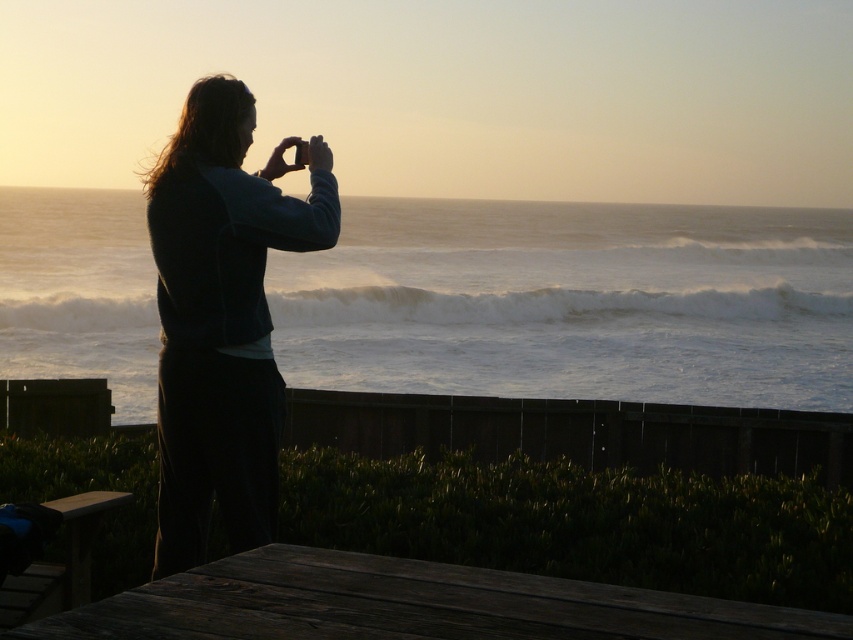
The height and width of the screenshot is (640, 853). Find the location of `silhouette fabric jacket at left`. silhouette fabric jacket at left is located at coordinates (222, 317).

Is silhouette fabric jacket at left thinner than dark brown wooden picnic table at lower center?

Indeed, silhouette fabric jacket at left has a lesser width compared to dark brown wooden picnic table at lower center.

Is point (258, 269) positioned after point (167, 632)?

Yes, it is.

The image size is (853, 640). Find the location of `silhouette fabric jacket at left`. silhouette fabric jacket at left is located at coordinates (222, 317).